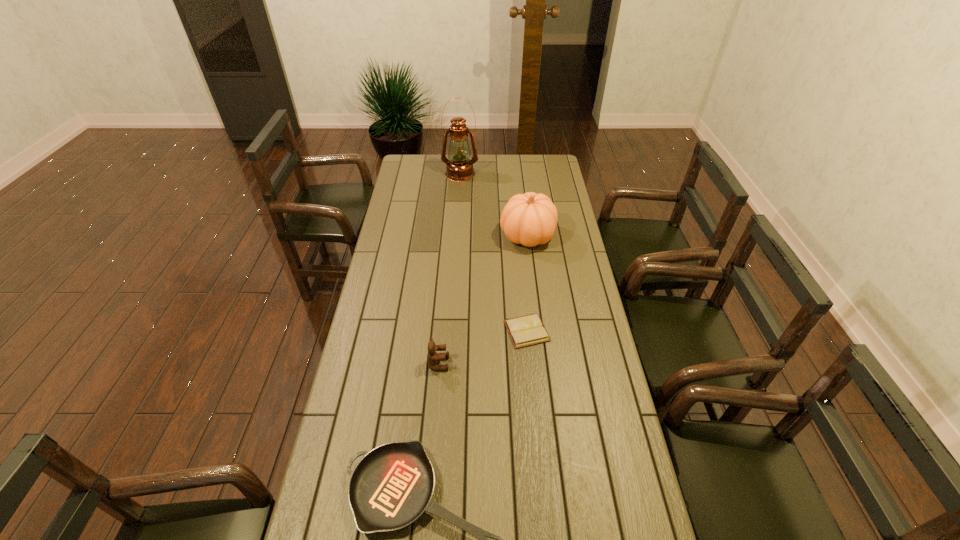
This screenshot has width=960, height=540. I want to click on oil lamp, so click(459, 168).

Where is `the tallest object`? the tallest object is located at coordinates (459, 168).

Locate an element on the screen. This screenshot has width=960, height=540. the fourth nearest object is located at coordinates (529, 219).

Where is `pumpkin`? This screenshot has height=540, width=960. pumpkin is located at coordinates (529, 219).

The width and height of the screenshot is (960, 540). I want to click on the third shortest object, so click(x=432, y=357).

Find the location of a particular element. teddy bear is located at coordinates (432, 357).

Identify the location of diary. click(x=527, y=330).

Find the location of a particular element. This screenshot has width=960, height=540. the shortest object is located at coordinates (527, 330).

At what (x,y) coordinates should I click in order to perform the action: click on free space located on the left of the tallest object. Please return your answer as a coordinate pair (x, y). The image size is (960, 540). Looking at the image, I should click on (431, 174).

Find the location of `free space located on the front of the second tallest object`. free space located on the front of the second tallest object is located at coordinates (535, 296).